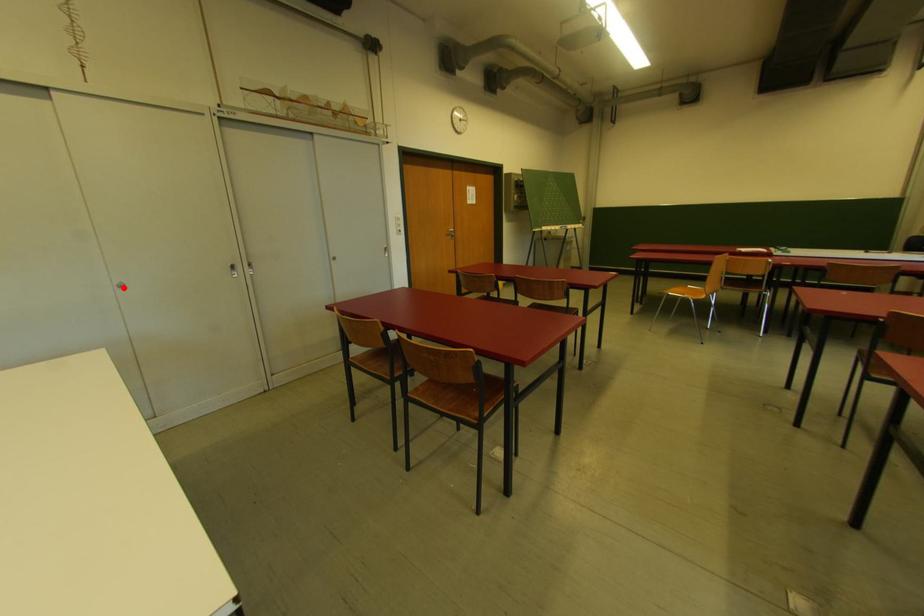
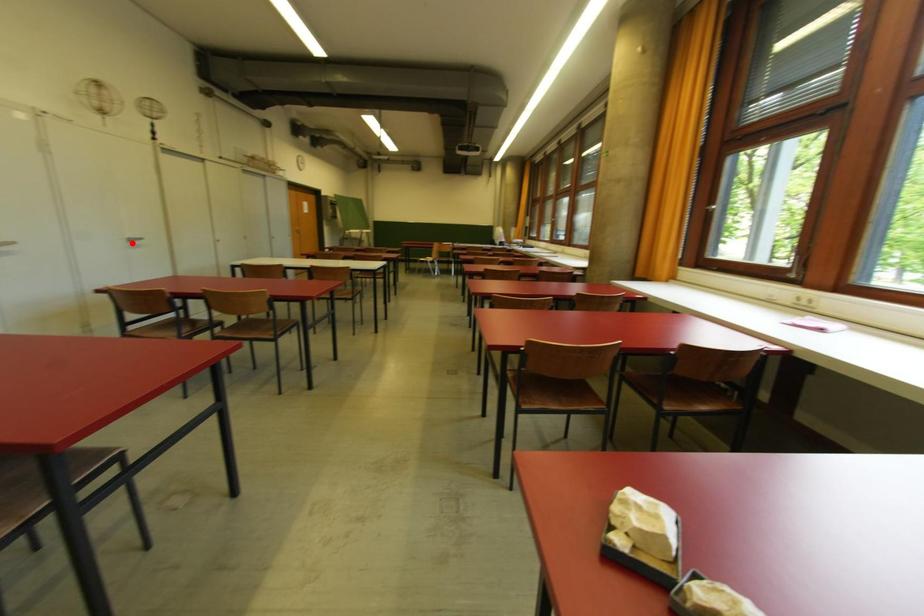
I am providing you with two images of the same scene from different viewpoints. A red point is marked on the first image and another point is marked on the second image. Are the points marked in image1 and image2 representing the same 3D position?

No